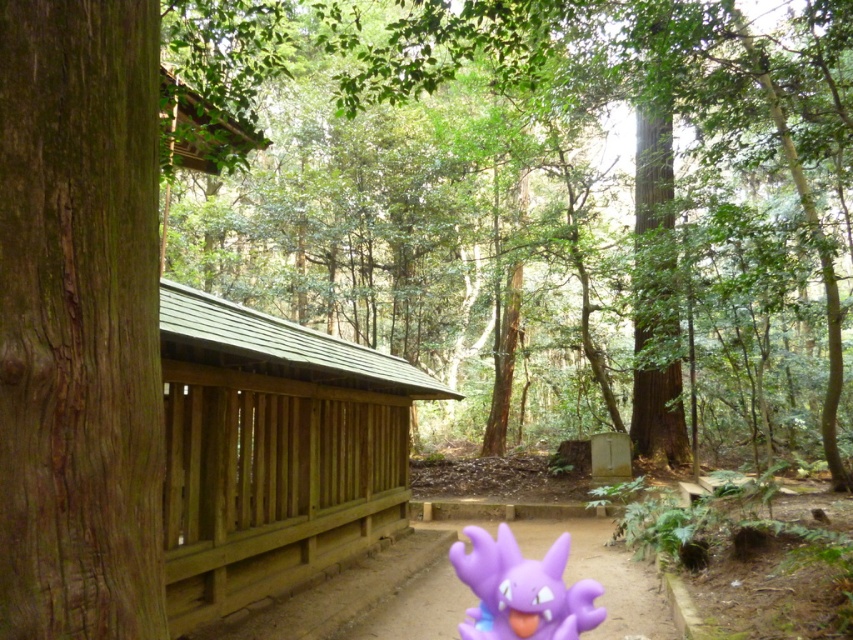
Question: Which point is closer to the camera?

Choices:
 (A) (113, 320)
 (B) (399, 205)

Answer: (A)

Question: Can you confirm if brown rough bark tree at left is positioned above purple rubber toy at lower center?

Choices:
 (A) no
 (B) yes

Answer: (B)

Question: Is brown rough bark tree at left closer to camera compared to purple rubber toy at lower center?

Choices:
 (A) no
 (B) yes

Answer: (B)

Question: Which point is farther from the camera taking this photo?

Choices:
 (A) (62, 83)
 (B) (577, 593)

Answer: (B)

Question: Is brown wooden fence at left smaller than brown rough bark tree at left?

Choices:
 (A) no
 (B) yes

Answer: (A)

Question: Among these points, which one is nearest to the camera?

Choices:
 (A) (50, 275)
 (B) (457, 627)
 (C) (793, 193)

Answer: (A)